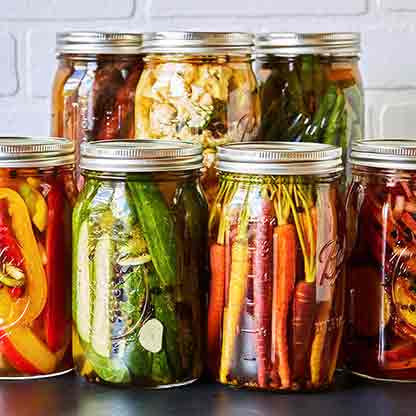
This screenshot has height=416, width=416. I want to click on glass jars, so click(313, 86), click(197, 106), click(119, 97), click(48, 229), click(115, 255), click(288, 271), click(364, 275).